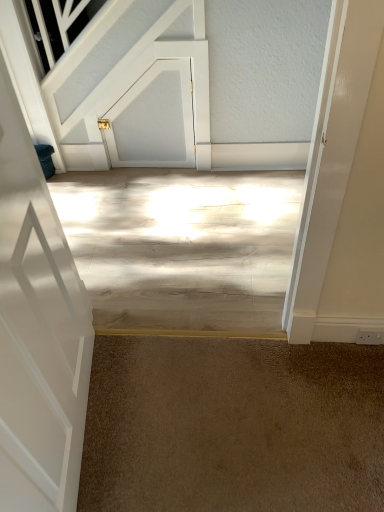
At what (x,y) coordinates should I click in order to perform the action: click on empty space that is ontop of brown carpet at lower center (from a real-world perspective). Please return your answer as a coordinate pair (x, y). The image size is (384, 512). Looking at the image, I should click on [247, 413].